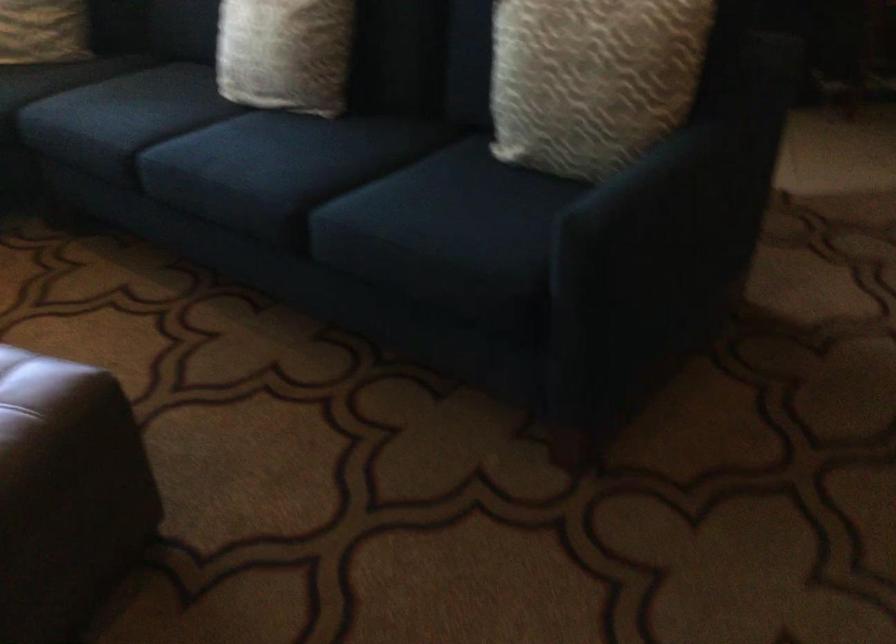
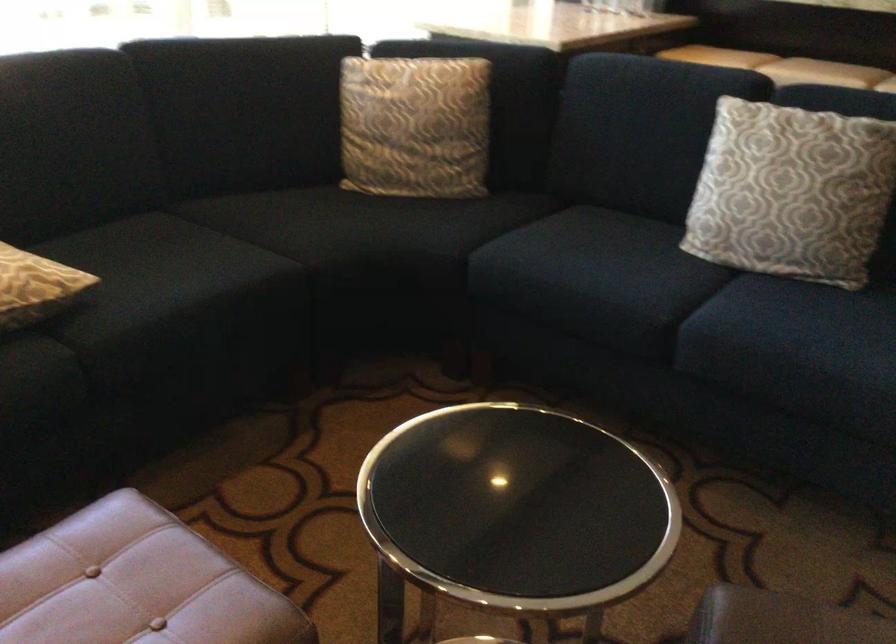
Find the pixel in the second image that matches the point at 92,108 in the first image.

(590, 274)